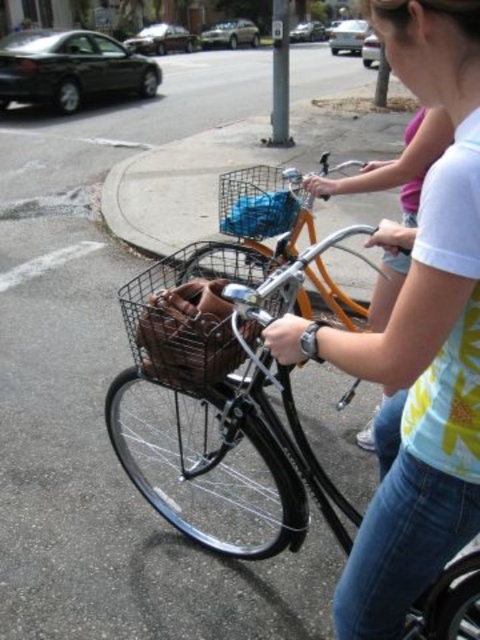
Question: Is white cotton shirt at upper right smaller than woven brown basket at center?

Choices:
 (A) no
 (B) yes

Answer: (A)

Question: Which object is positioned closest to the woven brown basket at center?

Choices:
 (A) brown woven basket at center
 (B) wire mesh basket at center

Answer: (A)

Question: Is white cotton shirt at center behind wire mesh basket at center?

Choices:
 (A) no
 (B) yes

Answer: (A)

Question: Which object is closer to the camera taking this photo?

Choices:
 (A) woven brown basket at center
 (B) white cotton shirt at upper right
 (C) wire mesh basket at center

Answer: (B)

Question: Is white cotton shirt at upper right closer to the viewer compared to brown woven basket at center?

Choices:
 (A) no
 (B) yes

Answer: (B)

Question: Which of the following is the farthest from the observer?

Choices:
 (A) (243, 556)
 (B) (469, 433)
 (C) (360, 432)
 (D) (247, 278)

Answer: (C)